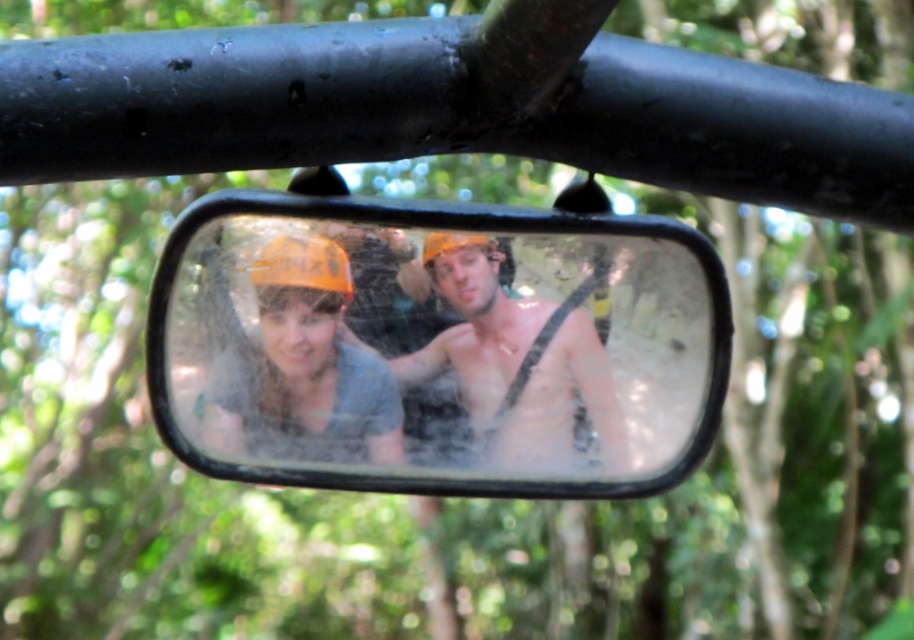
You are a hiker trying to check your helmet in the rearview mirror. Can you see the orange matte helmet at center in the clear glass mirror at center?

The clear glass mirror at center is to the right of orange matte helmet at center, so yes, the orange matte helmet at center is visible in the clear glass mirror at center.

You are a photographer trying to capture a clear shot of the two helmets in the rearview mirror. The shiny silver helmet at center and the orange matte helmet at center are both visible. Which helmet is positioned to the right side of the other?

The shiny silver helmet at center is to the right of orange matte helmet at center.

You are a driver looking at the rearview mirror in your car. You see the clear glass mirror at center and the shiny silver helmet at center. Which object is closer to you?

The clear glass mirror at center is closer to you because it is in front of the shiny silver helmet at center.